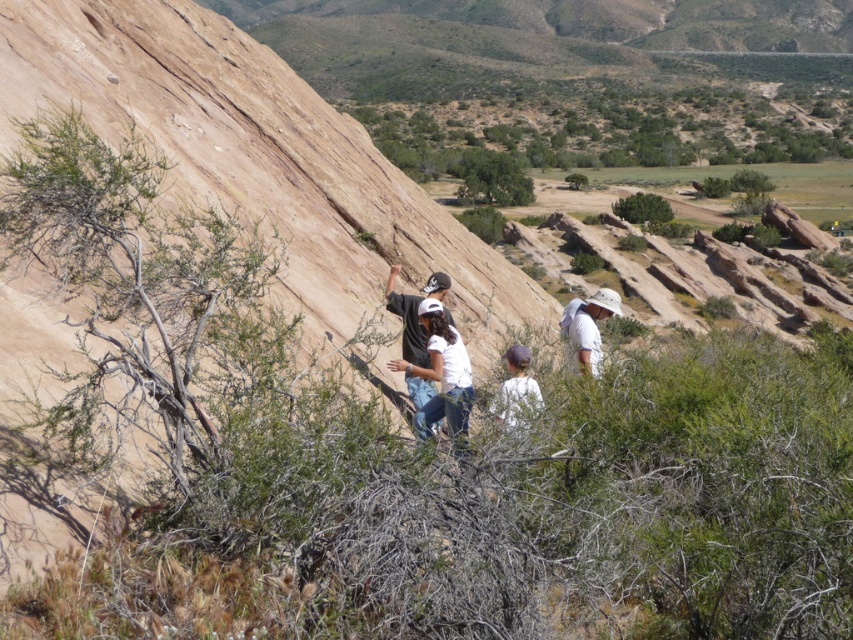
Question: Which object appears farthest from the camera in this image?

Choices:
 (A) white fabric at center
 (B) white matte shirt at center
 (C) white fabric hat at center

Answer: (A)

Question: Observing the image, what is the correct spatial positioning of white fabric hat at center in reference to white fabric at center?

Choices:
 (A) above
 (B) below

Answer: (A)

Question: Does white fabric hat at center have a lesser width compared to white fabric at center?

Choices:
 (A) yes
 (B) no

Answer: (B)

Question: In this image, where is white matte shirt at center located relative to white fabric at center?

Choices:
 (A) right
 (B) left

Answer: (B)

Question: Which point appears farthest from the camera in this image?

Choices:
 (A) (589, 356)
 (B) (531, 355)

Answer: (A)

Question: Among these objects, which one is farthest from the camera?

Choices:
 (A) white fabric at center
 (B) white fabric hat at center

Answer: (A)